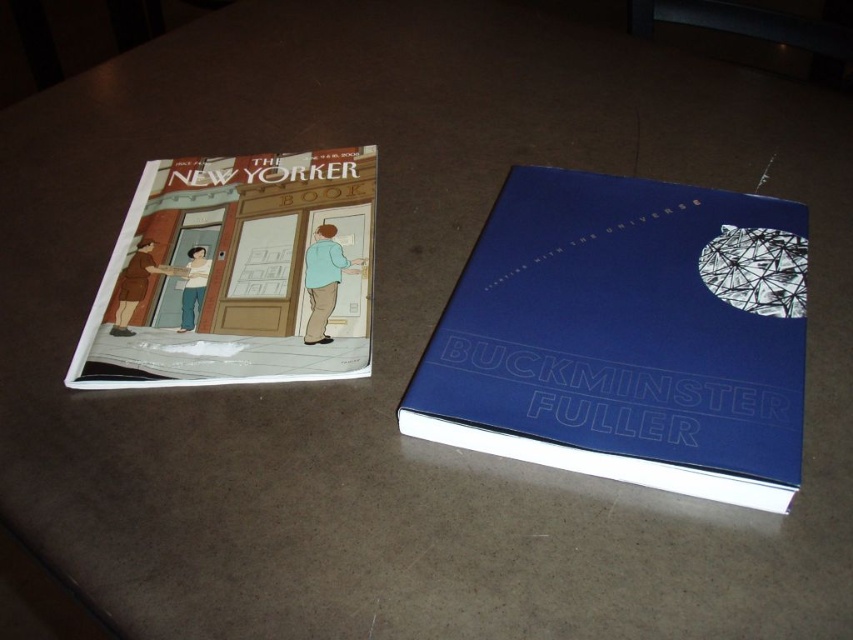
Consider the image. Is blue hardcover book at center taller than matte paper book at left?

Yes, blue hardcover book at center is taller than matte paper book at left.

Does blue hardcover book at center come in front of matte paper book at left?

That is True.

The image size is (853, 640). What do you see at coordinates (625, 337) in the screenshot? I see `blue hardcover book at center` at bounding box center [625, 337].

You are a GUI agent. You are given a task and a screenshot of the screen. Output one action in this format:
    pyautogui.click(x=<x>, y=<y>)
    Task: Click on the blue hardcover book at center
    The width and height of the screenshot is (853, 640).
    Given the screenshot: What is the action you would take?
    tap(625, 337)